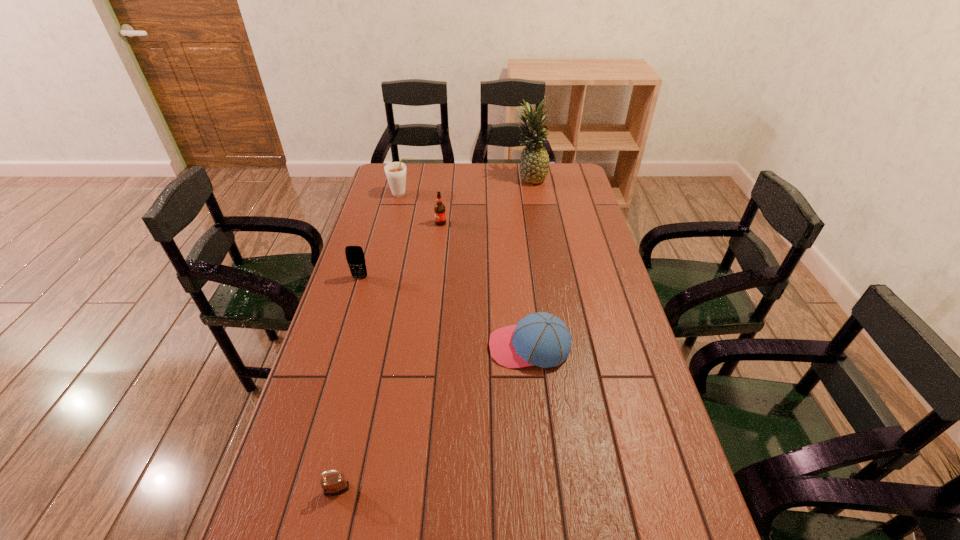
This screenshot has width=960, height=540. Find the location of `the tallest object`. the tallest object is located at coordinates (534, 163).

Locate an element on the screen. the farthest object is located at coordinates (534, 163).

Identify the location of the farther root beer. This screenshot has height=540, width=960. (395, 172).

At what (x,y) coordinates should I click in order to perform the action: click on the fifth nearest object. Please return your answer as a coordinate pair (x, y). Looking at the image, I should click on (395, 172).

Find the location of a particular element. The height and width of the screenshot is (540, 960). the shorter root beer is located at coordinates (439, 210).

At what (x,y) coordinates should I click in order to perform the action: click on the third object from right to left. Please return your answer as a coordinate pair (x, y). The image size is (960, 540). Looking at the image, I should click on (439, 210).

I want to click on the fourth farthest object, so click(355, 257).

Locate an element on the screen. The height and width of the screenshot is (540, 960). the second shortest object is located at coordinates (541, 339).

You are a GUI agent. You are given a task and a screenshot of the screen. Output one action in this format:
    pyautogui.click(x=<x>, y=<y>)
    Task: Click on the baseball cap
    Image resolution: width=960 pixels, height=540 pixels.
    Given the screenshot: What is the action you would take?
    pyautogui.click(x=541, y=339)

The height and width of the screenshot is (540, 960). Identify the location of padlock. (334, 484).